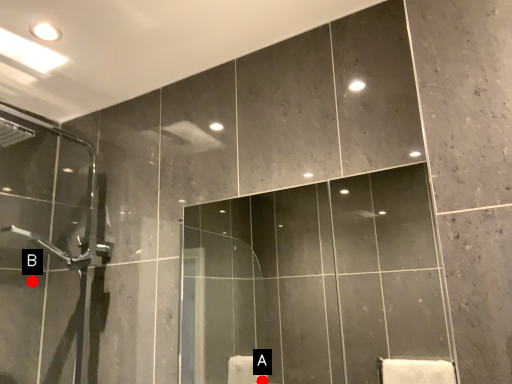
Question: Two points are circled on the image, labeled by A and B beside each circle. Which point appears farthest from the camera in this image?

Choices:
 (A) A is further
 (B) B is further

Answer: (A)